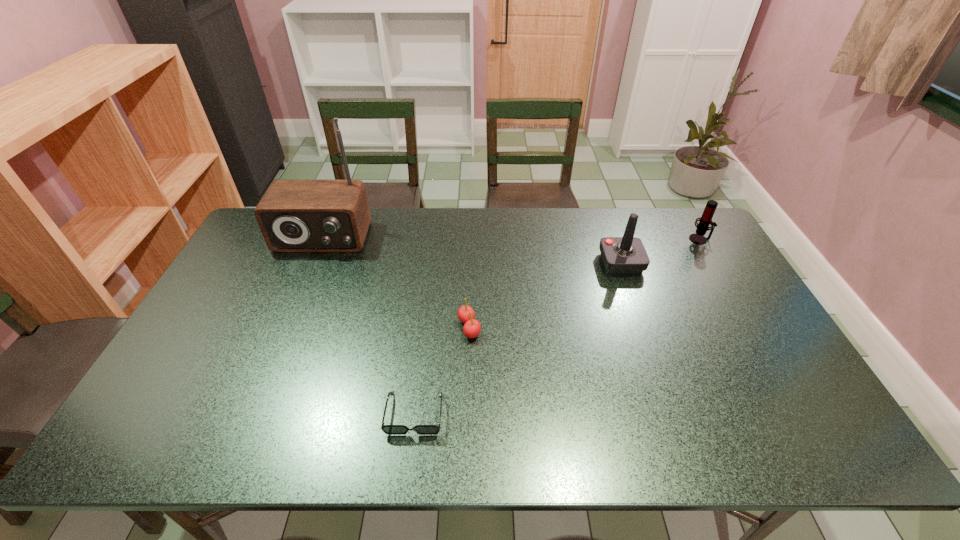
Find the location of `the tallest object`. the tallest object is located at coordinates (294, 215).

Find the location of `the leftmost object`. the leftmost object is located at coordinates click(x=294, y=215).

Identify the location of joystick. (621, 255).

Locate an element on the screen. the fourth shortest object is located at coordinates (621, 255).

You are a GUI agent. You are given a task and a screenshot of the screen. Output one action in this format:
    pyautogui.click(x=<x>, y=<y>)
    Task: Click on the microphone
    This screenshot has height=540, width=960.
    Given the screenshot: What is the action you would take?
    pyautogui.click(x=705, y=220)

At what (x,y) coordinates should I click in order to perform the action: click on the rightmost object. Please return your answer as a coordinate pair (x, y). Looking at the image, I should click on (705, 220).

Locate an element on the screen. The width and height of the screenshot is (960, 540). the third object from right to left is located at coordinates (471, 329).

Where is `cherry`? This screenshot has width=960, height=540. cherry is located at coordinates (471, 329).

Where is `the fourth object from right to left`? This screenshot has width=960, height=540. the fourth object from right to left is located at coordinates coord(387,429).

Image resolution: width=960 pixels, height=540 pixels. Find the location of `the shortest object`. the shortest object is located at coordinates (387, 429).